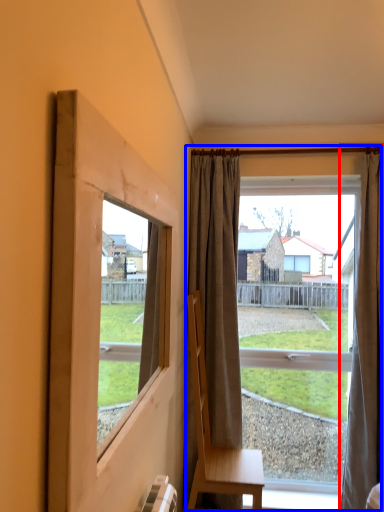
Question: Which object is closer to the camera taking this photo, curtain (highlighted by a red box) or window (highlighted by a blue box)?

Choices:
 (A) curtain
 (B) window

Answer: (A)